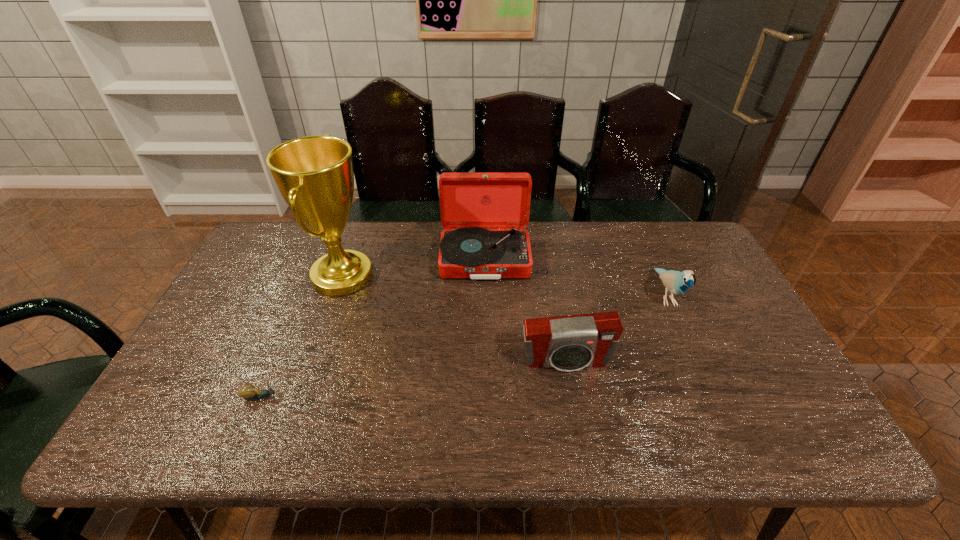
Locate an element on the screen. This screenshot has width=960, height=540. free space between the tallest object and the camera is located at coordinates (454, 320).

You are a GUI agent. You are given a task and a screenshot of the screen. Output one action in this format:
    pyautogui.click(x=<x>, y=<y>)
    Task: Click on the vacant area between the bird and the tallest object
    This screenshot has width=960, height=540.
    Given the screenshot: What is the action you would take?
    pyautogui.click(x=504, y=286)

I want to click on unoccupied position between the camera and the second tallest object, so click(x=525, y=311).

Locate an element on the screen. free space between the fourth farthest object and the phonograph_record is located at coordinates (525, 311).

At what (x,y) coordinates should I click in order to perform the action: click on free spot between the second nearest object and the tallest object. Please return your answer as a coordinate pair (x, y). The image size is (960, 540). Looking at the image, I should click on point(454,320).

Find the location of `vacant space that is in between the nearest object and the rightmost object`. vacant space that is in between the nearest object and the rightmost object is located at coordinates (464, 346).

This screenshot has height=540, width=960. I want to click on vacant region between the second tallest object and the bird, so click(x=575, y=277).

Point out which object is positioned as the third nearest to the second nearest object. Please provide its 2D coordinates. Your answer should be formatted as a tuple, i.e. [(x, y)], where the tuple contains the x and y coordinates of a point satisfying the conditions above.

[(314, 174)]

Find the location of a particular element. The image size is (960, 540). the closest object relative to the bird is located at coordinates (569, 343).

Image resolution: width=960 pixels, height=540 pixels. Identify the location of free space that satisfies the following two spatial constraints: 1. on the front-facing side of the second tallest object; 2. on the front-facing side of the shortest object. (487, 397).